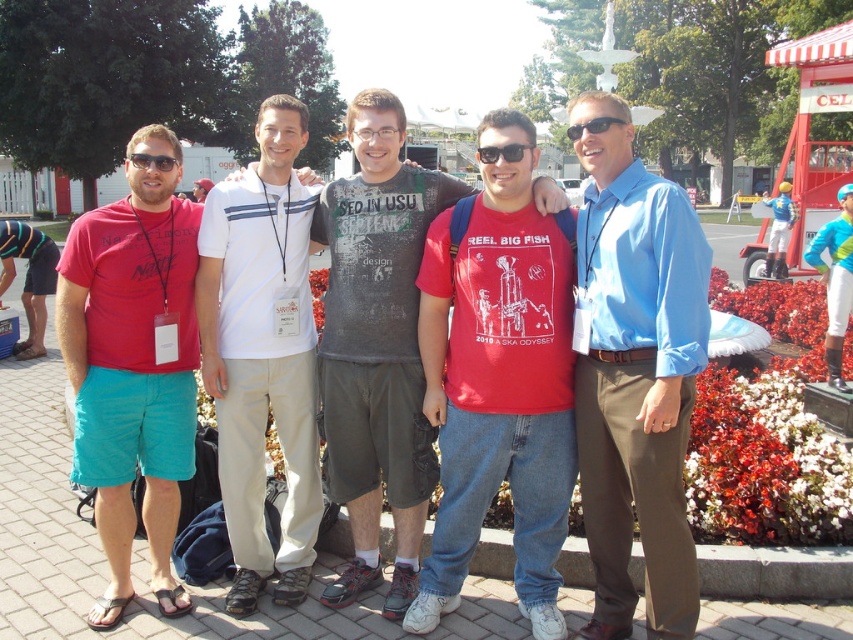
You are a photographer trying to capture a group shot of the blue smooth shirt at center and the white cotton polo shirt at center. The camera you are using has a maximum focus range of 5 feet. Can you fit both subjects within the camera frame without moving the camera?

The blue smooth shirt at center and white cotton polo shirt at center are 4.94 feet apart from each other, which is within the camera maximum focus range of 5 feet. Therefore, both subjects can be captured in the frame without moving the camera.